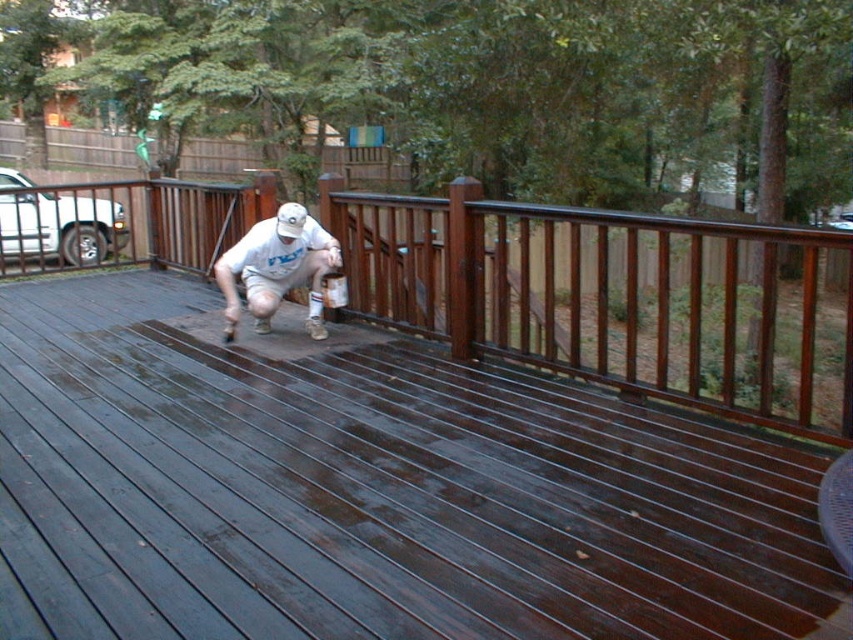
Question: Is dark brown wood at center closer to camera compared to matte white t-shirt at center?

Choices:
 (A) no
 (B) yes

Answer: (B)

Question: Is dark stained wood deck at center thinner than dark brown wood at center?

Choices:
 (A) yes
 (B) no

Answer: (A)

Question: Which object is farther from the camera taking this photo?

Choices:
 (A) dark brown wood at center
 (B) matte white t-shirt at center
 (C) dark stained wood deck at center

Answer: (B)

Question: Which object is closer to the camera taking this photo?

Choices:
 (A) dark brown wood at center
 (B) dark stained wood deck at center

Answer: (B)

Question: Does dark stained wood deck at center appear over matte white t-shirt at center?

Choices:
 (A) no
 (B) yes

Answer: (A)

Question: Which point is farther to the camera?

Choices:
 (A) matte white t-shirt at center
 (B) dark brown wood at center
 (C) dark stained wood deck at center

Answer: (A)